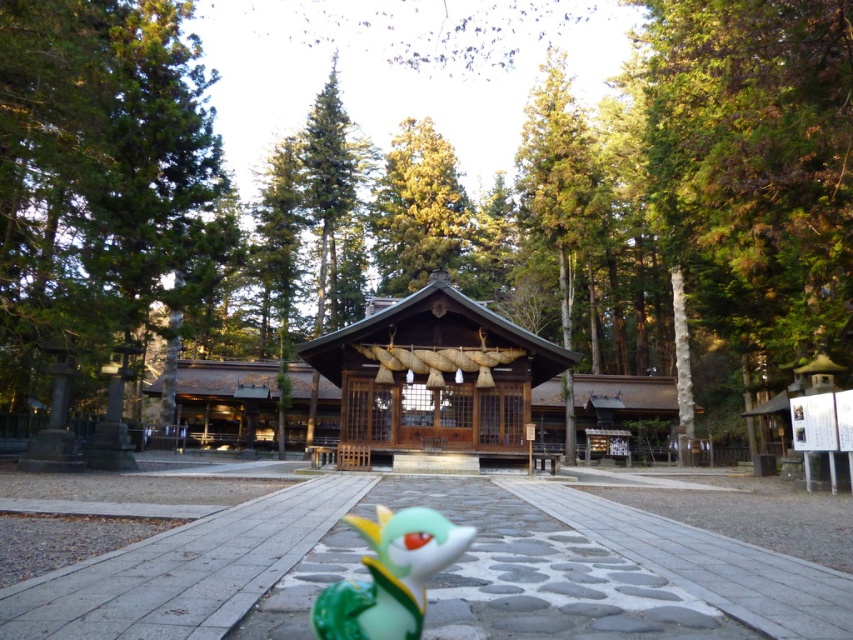
Can you confirm if green leafy tree at center is wider than green textured tree at left?

Correct, the width of green leafy tree at center exceeds that of green textured tree at left.

Is green leafy tree at center thinner than green textured tree at left?

In fact, green leafy tree at center might be wider than green textured tree at left.

Is point (140, 236) less distant than point (184, 58)?

Yes, point (140, 236) is closer to viewer.

This screenshot has width=853, height=640. In order to click on green leafy tree at center in this screenshot , I will do click(432, 198).

Does green textured tree at left have a lesser width compared to green glossy toy at lower center?

Incorrect, green textured tree at left's width is not less than green glossy toy at lower center's.

In the scene shown: Can you confirm if green textured tree at left is positioned above green glossy toy at lower center?

Yes, green textured tree at left is above green glossy toy at lower center.

Where is `green textured tree at left`? This screenshot has height=640, width=853. green textured tree at left is located at coordinates (102, 182).

At what (x,y) coordinates should I click in order to perform the action: click on green textured tree at left. Please return your answer as a coordinate pair (x, y). The width and height of the screenshot is (853, 640). Looking at the image, I should click on (102, 182).

Is green leafy tree at center bigger than green glossy toy at lower center?

Indeed, green leafy tree at center has a larger size compared to green glossy toy at lower center.

Who is more forward, (712, 221) or (412, 602)?

Point (412, 602) is more forward.

Where is `green leafy tree at center`? The height and width of the screenshot is (640, 853). green leafy tree at center is located at coordinates (432, 198).